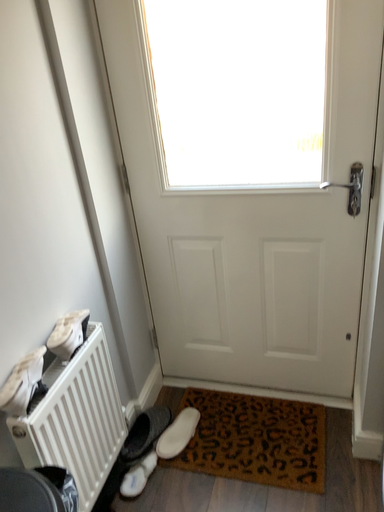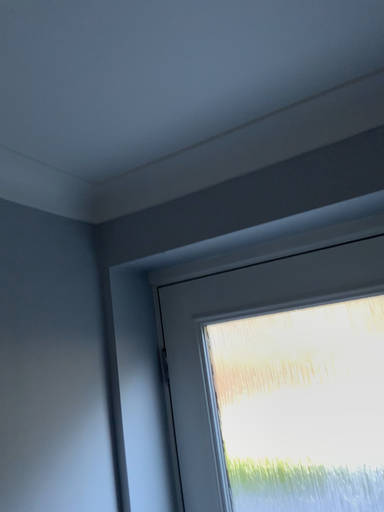
Question: Which way did the camera rotate in the video?

Choices:
 (A) rotated right
 (B) rotated left

Answer: (B)